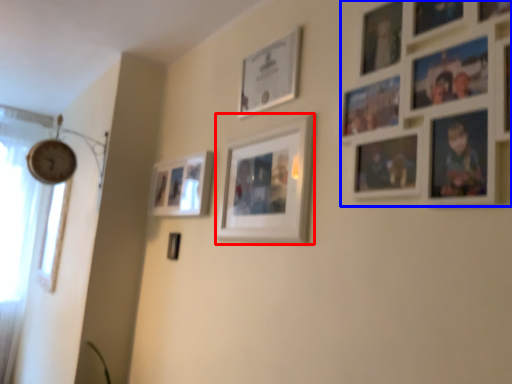
Question: Which object appears closest to the camera in this image, picture frame (highlighted by a red box) or picture frame (highlighted by a blue box)?

Choices:
 (A) picture frame
 (B) picture frame

Answer: (B)